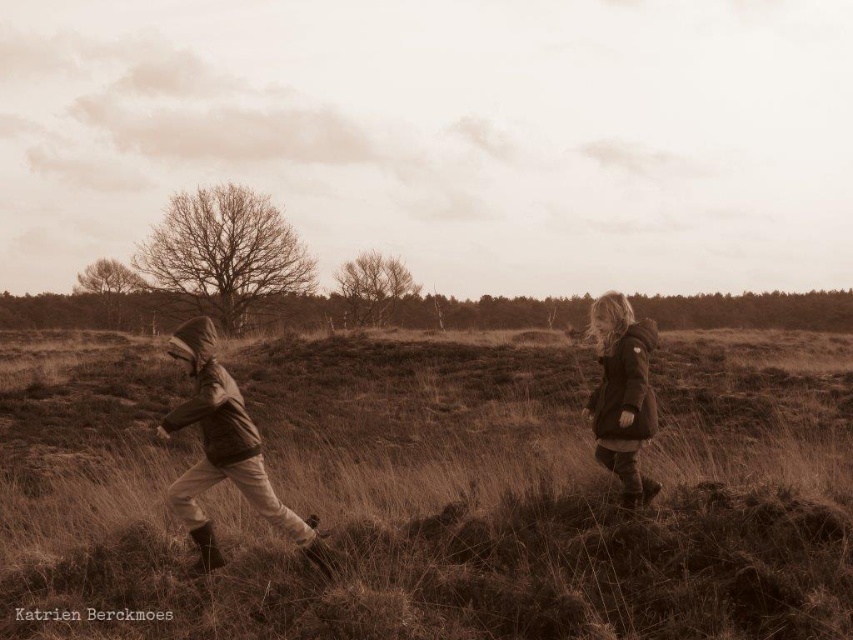
Is brown matte jacket at left to the right of matte brown jacket at right from the viewer's perspective?

In fact, brown matte jacket at left is to the left of matte brown jacket at right.

Between point (308, 536) and point (648, 403), which one is positioned in front?

Point (308, 536) is more forward.

Find the location of `brown matte jacket at left`. brown matte jacket at left is located at coordinates (224, 449).

Is point (529, 433) in front of point (642, 330)?

No, (529, 433) is behind (642, 330).

Who is more forward, (552, 419) or (633, 458)?

Point (633, 458)

Find the location of a particular element. brown grassy at center is located at coordinates (434, 493).

Does brown grassy at center have a lesser width compared to brown matte jacket at left?

No, brown grassy at center is not thinner than brown matte jacket at left.

Can you confirm if brown grassy at center is shorter than brown matte jacket at left?

Correct, brown grassy at center is not as tall as brown matte jacket at left.

Is point (555, 596) positioned in front of point (238, 449)?

Yes, point (555, 596) is in front of point (238, 449).

Locate an element on the screen. brown grassy at center is located at coordinates (434, 493).